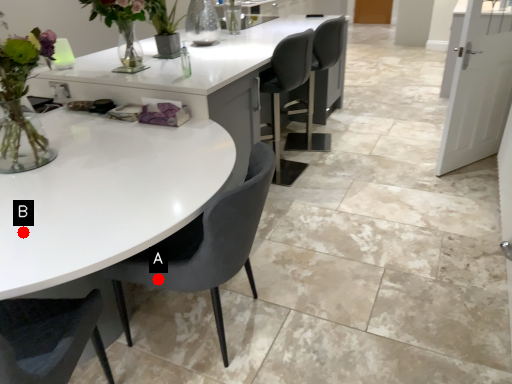
Question: Two points are circled on the image, labeled by A and B beside each circle. Among these points, which one is farthest from the camera?

Choices:
 (A) A is further
 (B) B is further

Answer: (A)